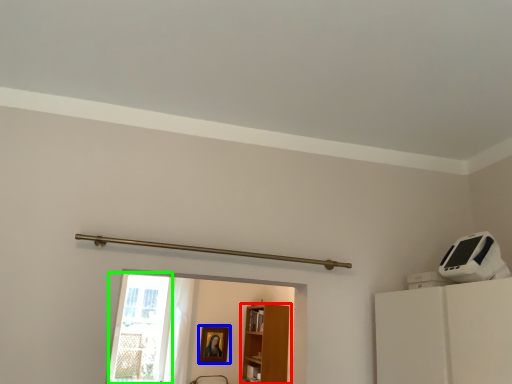
Question: Based on their relative distances, which object is farther from furniture (highlighted by a red box)? Choose from picture frame (highlighted by a blue box) and glass door (highlighted by a green box).

Choices:
 (A) picture frame
 (B) glass door

Answer: (B)